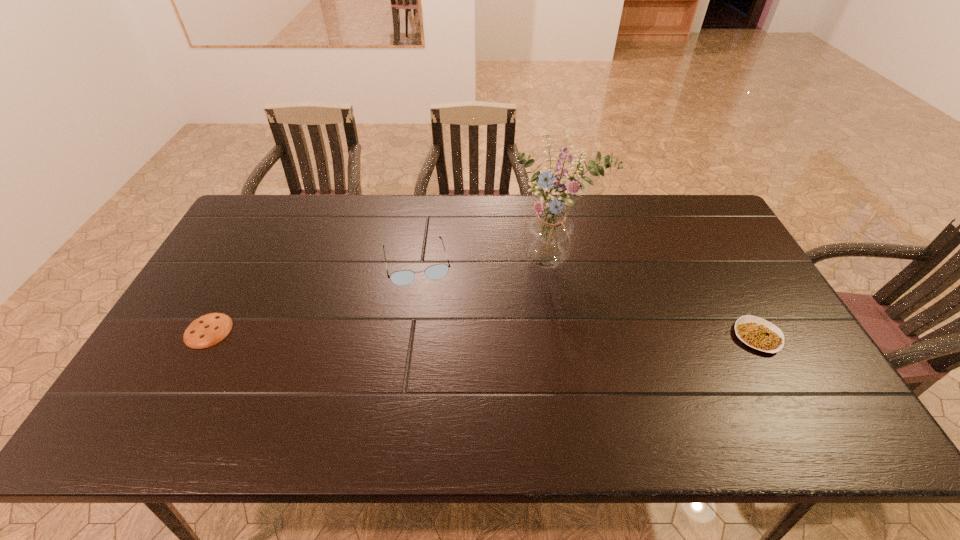
Where is `vacant area at the left edge of the desktop`? The image size is (960, 540). vacant area at the left edge of the desktop is located at coordinates (169, 342).

Find the location of `vacant region at the far left corner`. vacant region at the far left corner is located at coordinates (252, 227).

Where is `vacant space at the far right corner of the desktop`? The width and height of the screenshot is (960, 540). vacant space at the far right corner of the desktop is located at coordinates (699, 209).

In order to click on free space between the spectacles and the cookie in this screenshot , I will do `click(312, 296)`.

Identify the location of vacant area between the second shortest object and the second tallest object. (587, 300).

This screenshot has height=540, width=960. What are the coordinates of `free point between the cookie and the tallest object` in the screenshot? It's located at (381, 295).

Where is `vacant area between the spectacles and the shortest object`? This screenshot has height=540, width=960. vacant area between the spectacles and the shortest object is located at coordinates (312, 296).

At what (x,y) coordinates should I click in order to perform the action: click on free space that is in between the bouquet and the third shortest object. Please return your answer as a coordinate pair (x, y). The height and width of the screenshot is (540, 960). Looking at the image, I should click on (486, 262).

This screenshot has height=540, width=960. Identify the location of free point between the spectacles and the third object from left to right. (486, 262).

I want to click on free space between the leftmost object and the spectacles, so click(x=312, y=296).